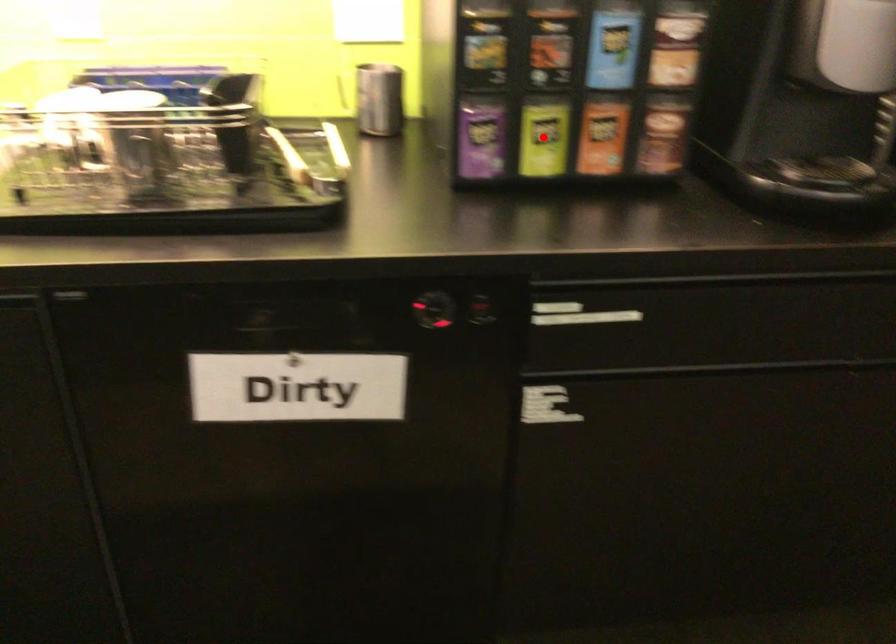
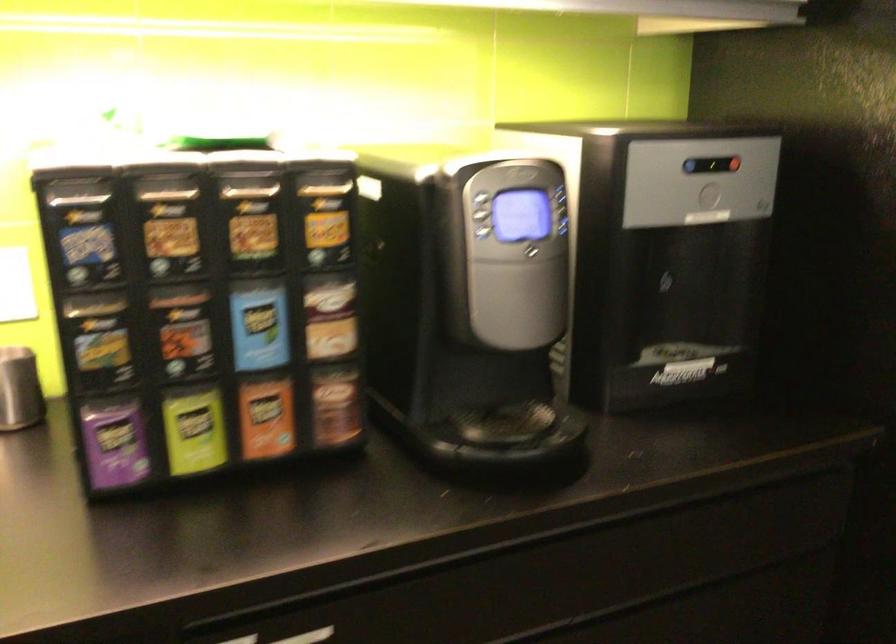
Question: I am providing you with two images of the same scene from different viewpoints. In image1, a red point is highlighted. Considering the same 3D point in image2, which of the following is correct?

Choices:
 (A) It is closer
 (B) It is farther

Answer: (A)